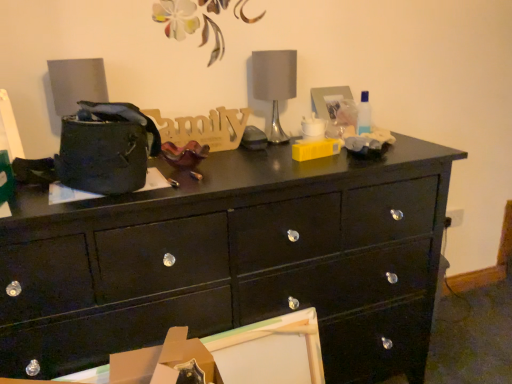
Question: Does point (254, 76) appear closer or farther from the camera than point (124, 339)?

Choices:
 (A) closer
 (B) farther

Answer: (B)

Question: Considering the relative positions of satin silver table lamp at center and glossy black drawer at lower left in the image provided, is satin silver table lamp at center to the left or to the right of glossy black drawer at lower left?

Choices:
 (A) right
 (B) left

Answer: (A)

Question: Which object is positioned closest to the cardboard box at lower center?

Choices:
 (A) satin silver table lamp at center
 (B) glossy black drawer at lower left
 (C) black glossy chest of drawers at center

Answer: (B)

Question: Based on their relative distances, which object is nearer to the black glossy chest of drawers at center?

Choices:
 (A) cardboard box at lower center
 (B) satin silver table lamp at center
 (C) glossy black drawer at lower left

Answer: (C)